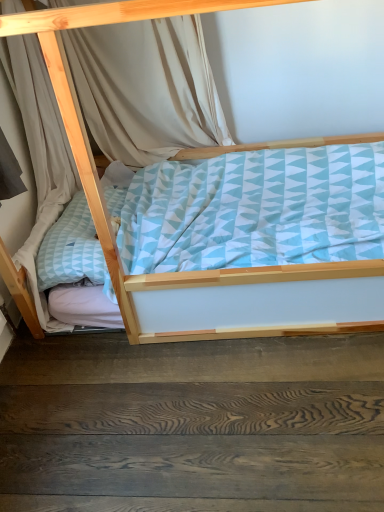
This screenshot has height=512, width=384. In order to click on free point above dark wood floor at lower center (from a real-world perspective) in this screenshot , I will do `click(183, 401)`.